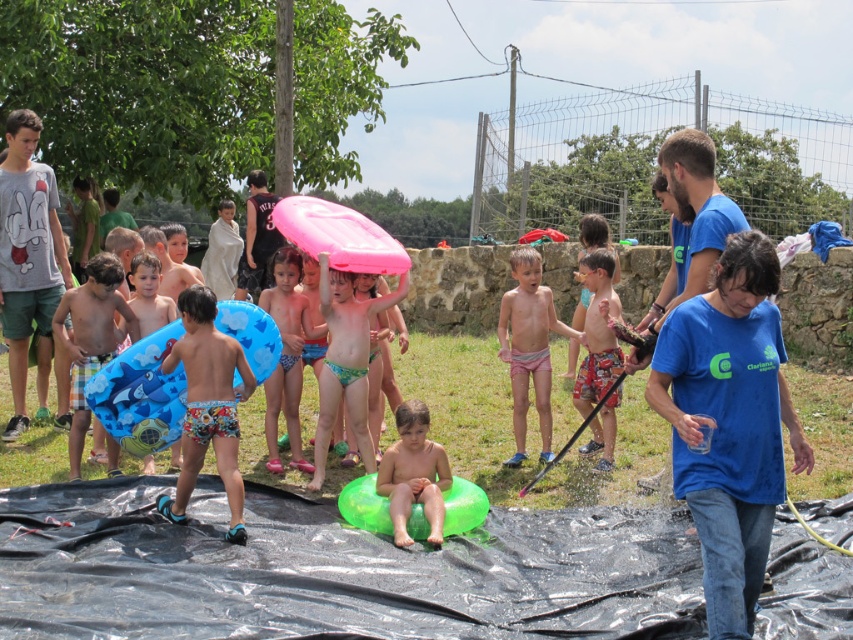
Question: Among these objects, which one is farthest from the camera?

Choices:
 (A) floral-patterned shorts at center
 (B) smooth green float at center

Answer: (B)

Question: Is floral-patterned shorts at center wider than smooth green float at center?

Choices:
 (A) no
 (B) yes

Answer: (B)

Question: Can you confirm if pink rubber ring at center is smaller than smooth green float at center?

Choices:
 (A) yes
 (B) no

Answer: (B)

Question: Among these objects, which one is nearest to the camera?

Choices:
 (A) smooth green float at center
 (B) pink rubber ring at center
 (C) pink fabric shorts at center
 (D) printed cotton shorts at center

Answer: (A)

Question: Can you confirm if pink fabric shorts at center is positioned to the left of pink rubber ring at center?

Choices:
 (A) yes
 (B) no

Answer: (B)

Question: Estimate the real-world distances between objects in this image. Which object is closer to the smooth green float at center?

Choices:
 (A) pink fabric shorts at center
 (B) printed cotton shorts at center
 (C) pink rubber ring at center
 (D) floral-patterned shorts at center

Answer: (D)